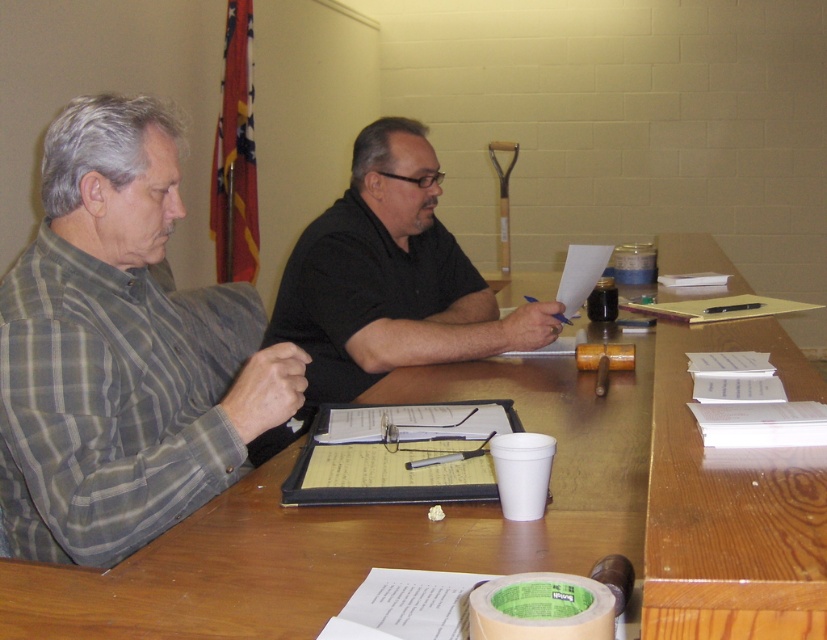
Does point (720, 472) come farther from viewer compared to point (101, 426)?

That is False.

Is wooden table at center bigger than plaid cotton shirt at left?

Correct, wooden table at center is larger in size than plaid cotton shirt at left.

Between point (555, 506) and point (51, 147), which one is positioned in front?

Point (555, 506)

What are the coordinates of `wooden table at center` in the screenshot? It's located at (493, 516).

Does black matte shirt at center have a smaller size compared to white paper at center?

No, black matte shirt at center is not smaller than white paper at center.

Who is lower down, black matte shirt at center or white paper at center?

black matte shirt at center is below.

This screenshot has width=827, height=640. Find the location of `black matte shirt at center`. black matte shirt at center is located at coordinates (390, 278).

Is plaid cotton shirt at left below black matte shirt at center?

Actually, plaid cotton shirt at left is above black matte shirt at center.

Is plaid cotton shirt at left to the left of black matte shirt at center from the viewer's perspective?

Yes, plaid cotton shirt at left is to the left of black matte shirt at center.

Which is behind, point (85, 305) or point (395, 358)?

The point (395, 358) is behind.

Identify the location of plaid cotton shirt at left. (x=122, y=352).